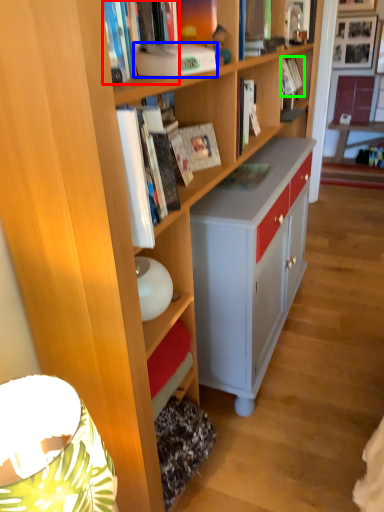
Question: Based on their relative distances, which object is farther from book (highlighted by a red box)? Choose from paperback book (highlighted by a blue box) and book (highlighted by a green box).

Choices:
 (A) paperback book
 (B) book

Answer: (B)